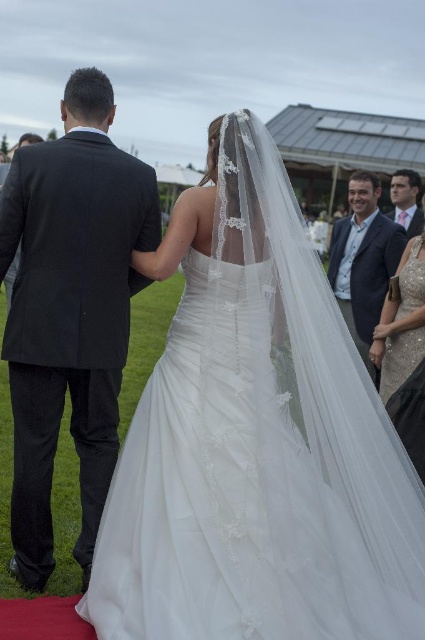
You are a photographer at the wedding. You need to position yourself so that both the white tulle dress at center and the dark gray suit at left are visible in your shot. Which object should you focus on first to ensure both are in frame?

You should focus on the white tulle dress at center first because it might be wider than the dark gray suit at left, so centering it ensures the narrower dark gray suit at left will also fit into the frame.